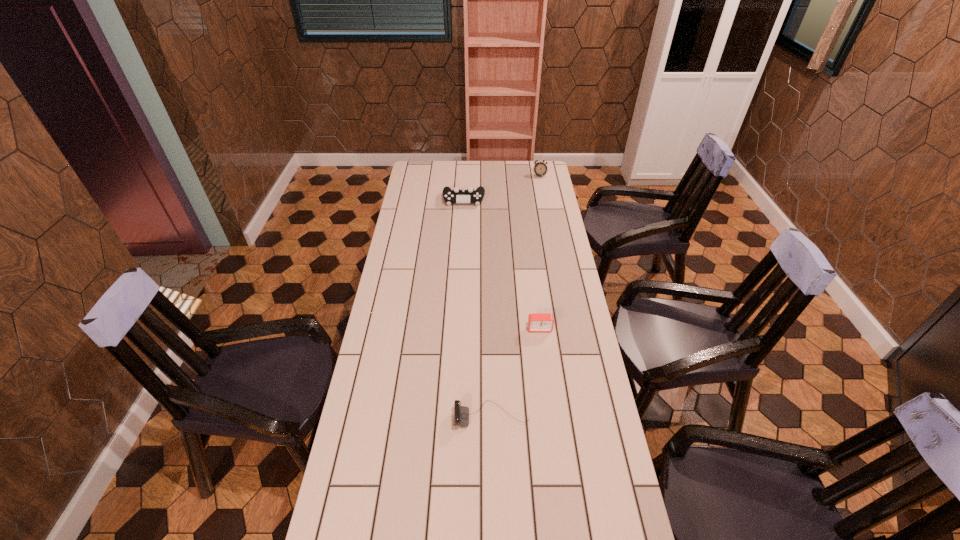
Locate an element on the screen. free space located on the front-facing side of the shortest object is located at coordinates (385, 416).

I want to click on vacant area located on the front-facing side of the shortest object, so click(x=397, y=416).

This screenshot has height=540, width=960. I want to click on vacant space located 0.050m on the front-facing side of the shortest object, so click(438, 416).

The width and height of the screenshot is (960, 540). Find the location of `object that is at the far edge`. object that is at the far edge is located at coordinates (540, 168).

Locate an element on the screen. Image resolution: width=960 pixels, height=540 pixels. object at the far right corner is located at coordinates (540, 168).

This screenshot has height=540, width=960. I want to click on vacant region at the far edge of the desktop, so click(478, 183).

Locate an element on the screen. The width and height of the screenshot is (960, 540). vacant region at the left edge of the desktop is located at coordinates (413, 197).

Find the location of `vacant region at the right edge of the desktop`. vacant region at the right edge of the desktop is located at coordinates (607, 467).

This screenshot has height=540, width=960. I want to click on unoccupied position between the second farthest object and the shorter alarm clock, so click(502, 264).

Identify the location of vacant space that is in between the shortest object and the right alarm clock. (516, 296).